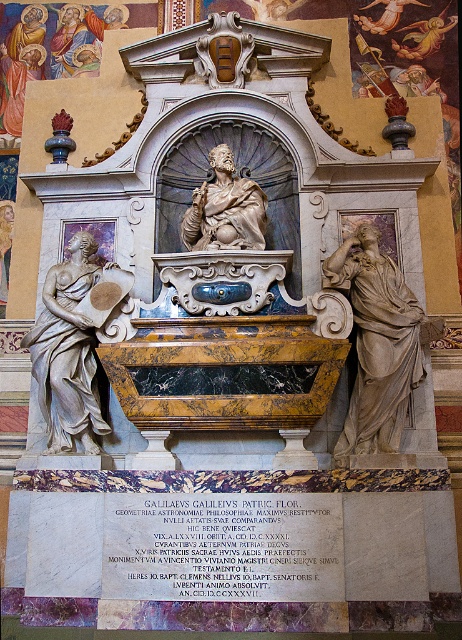
You are a tour guide leading a group around the monument. You want to ensure everyone can see both the matte stone figure at right and the white marble statue at left. Considering the spacing between them, is there enough room for the group to comfortably walk between them?

The distance between the matte stone figure at right and the white marble statue at left is 14.08 meters, which provides ample space for the group to walk comfortably between them.

Looking at the grand marble monument dedicated to Galileo Galilei, you notice two statues. One is the white marble statue at left and the other is the matte stone statue at center. Which statue is taller?

The white marble statue at left is much taller than the matte stone statue at center.

Looking at this image, you are standing at the entrance of the monument and want to place a 3 meter wide decorative panel between the white marble statue at left and the matte stone statue at center. Is there enough space to fit it without moving either statue?

The white marble statue at left is 8.69 meters away from the matte stone statue at center. Since the distance between them is greater than 3 meters, the 3 meter wide decorative panel can be placed between them without moving either statue.